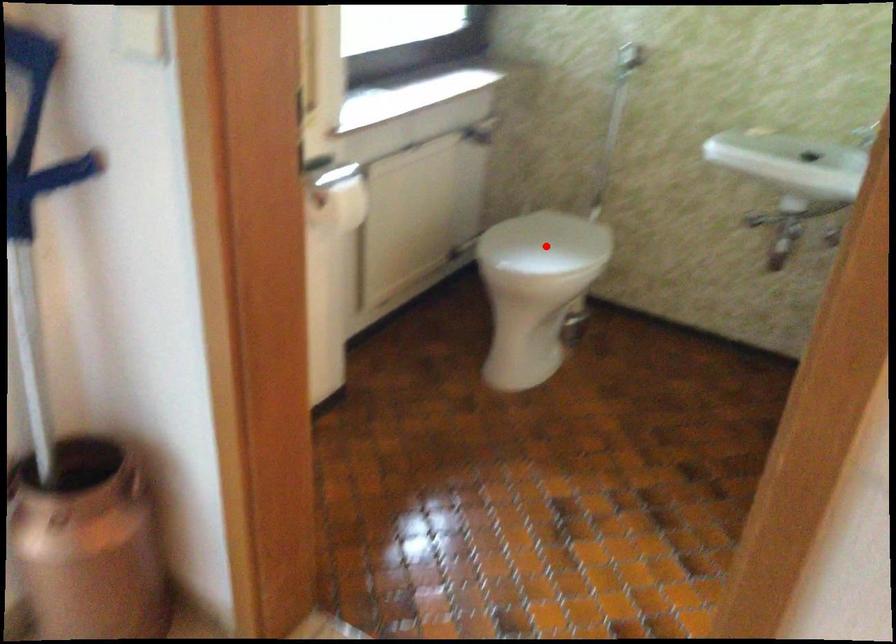
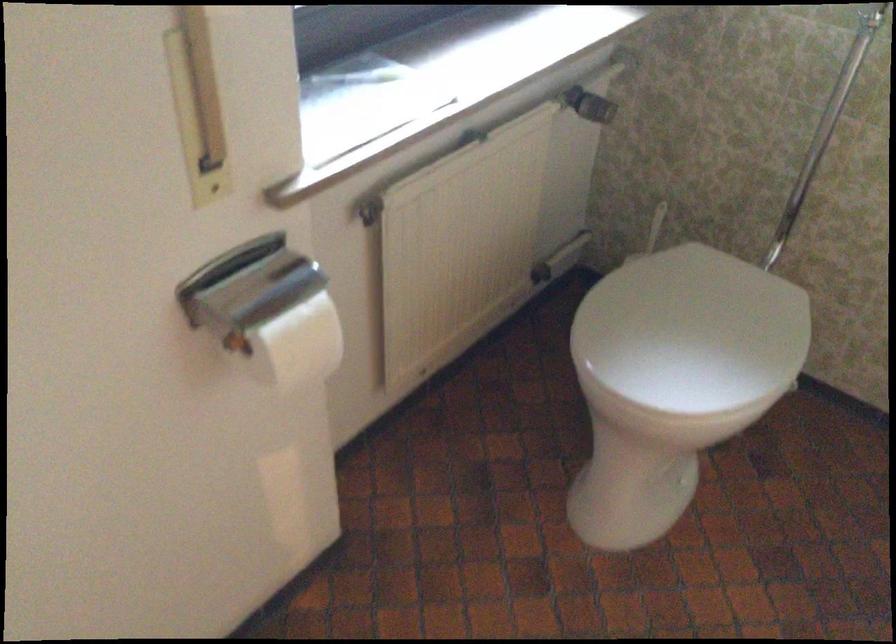
Question: I am providing you with two images of the same scene from different viewpoints. A red point is marked on the first image. Is the red point's position out of view in image 2?

Choices:
 (A) Yes
 (B) No

Answer: (B)